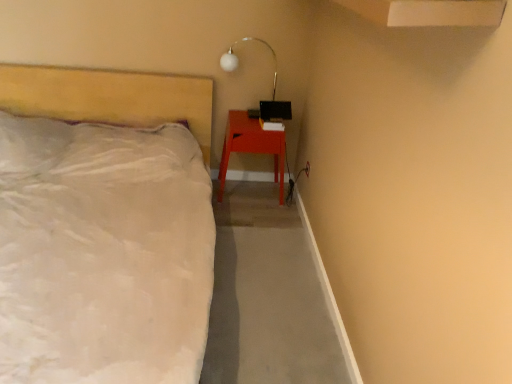
Question: Does matte wood nightstand at lower right appear on the right side of matte white bed at left?

Choices:
 (A) yes
 (B) no

Answer: (A)

Question: Is matte wood nightstand at lower right far from matte white bed at left?

Choices:
 (A) yes
 (B) no

Answer: (B)

Question: Does matte wood nightstand at lower right have a lesser width compared to matte white bed at left?

Choices:
 (A) yes
 (B) no

Answer: (A)

Question: Does matte wood nightstand at lower right have a greater height compared to matte white bed at left?

Choices:
 (A) yes
 (B) no

Answer: (B)

Question: Is matte wood nightstand at lower right at the left side of matte white bed at left?

Choices:
 (A) no
 (B) yes

Answer: (A)

Question: From a real-world perspective, is matte wood nightstand at lower right located higher than matte white bed at left?

Choices:
 (A) yes
 (B) no

Answer: (B)

Question: Is matte wood nightstand at lower right located within white glass lamp at upper center?

Choices:
 (A) no
 (B) yes

Answer: (A)

Question: Is white glass lamp at upper center wider than matte wood nightstand at lower right?

Choices:
 (A) yes
 (B) no

Answer: (B)

Question: From a real-world perspective, is white glass lamp at upper center beneath matte wood nightstand at lower right?

Choices:
 (A) no
 (B) yes

Answer: (A)

Question: Are white glass lamp at upper center and matte wood nightstand at lower right beside each other?

Choices:
 (A) no
 (B) yes

Answer: (A)

Question: Is white glass lamp at upper center oriented towards matte wood nightstand at lower right?

Choices:
 (A) no
 (B) yes

Answer: (A)

Question: Is white glass lamp at upper center not near matte wood nightstand at lower right?

Choices:
 (A) no
 (B) yes

Answer: (A)

Question: Is matte wood nightstand at lower right not near white glass lamp at upper center?

Choices:
 (A) no
 (B) yes

Answer: (A)